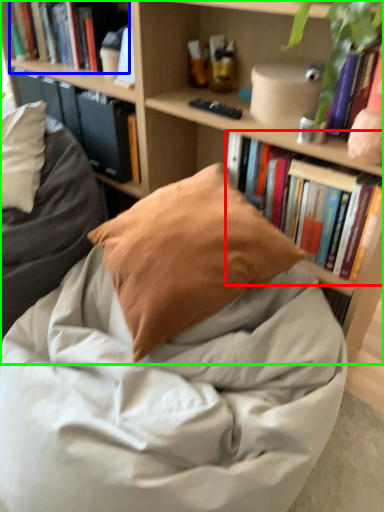
Question: Based on their relative distances, which object is farther from book (highlighted by a red box)? Choose from book (highlighted by a blue box) and bookcase (highlighted by a green box).

Choices:
 (A) book
 (B) bookcase

Answer: (A)